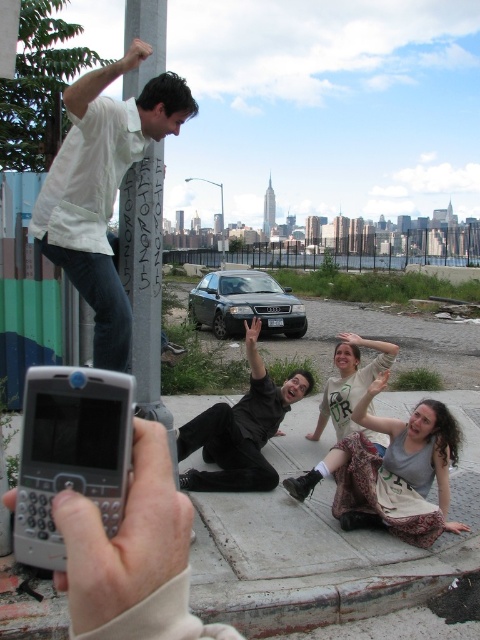
Question: Where is white matte shirt at upper left located in relation to white painted metal pole at upper left in the image?

Choices:
 (A) above
 (B) below

Answer: (A)

Question: In this image, where is white cotton shirt at lower right located relative to white painted metal pole at upper left?

Choices:
 (A) left
 (B) right

Answer: (B)

Question: Among these objects, which one is nearest to the camera?

Choices:
 (A) black matte suit at center
 (B) white painted metal pole at upper left
 (C) white cotton shirt at lower right
 (D) white cotton shirt at center

Answer: (B)

Question: Which of the following is the closest to the observer?

Choices:
 (A) (175, 474)
 (B) (351, 515)
 (C) (285, 387)
 (D) (327, 419)

Answer: (A)

Question: Is the position of white matte shirt at upper left more distant than that of white painted metal pole at upper left?

Choices:
 (A) no
 (B) yes

Answer: (B)

Question: Which object is closer to the camera taking this photo?

Choices:
 (A) black matte suit at center
 (B) white cotton shirt at center

Answer: (A)